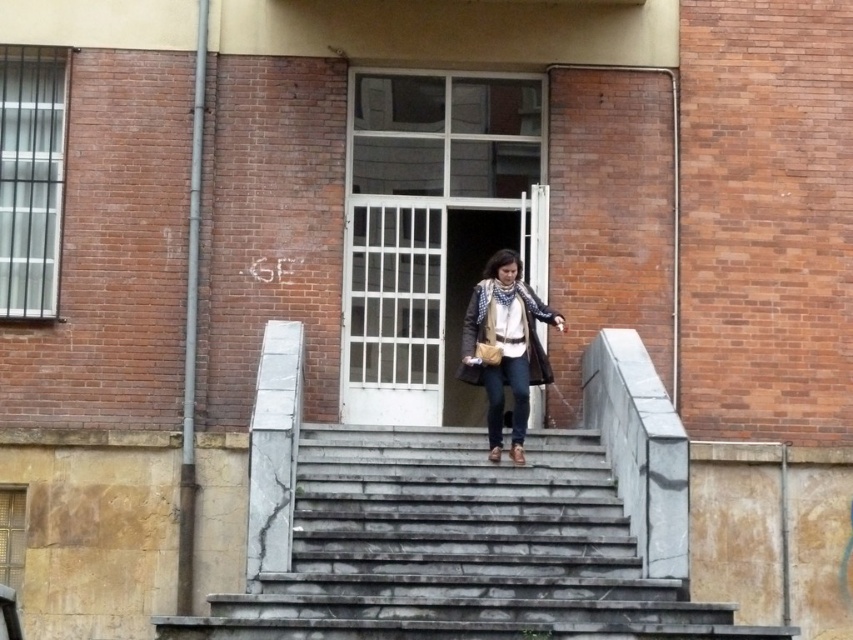
Question: Does gray marble stairs at center appear on the right side of brown leather jacket at center?

Choices:
 (A) yes
 (B) no

Answer: (B)

Question: Considering the relative positions of gray marble stairs at center and brown leather jacket at center in the image provided, where is gray marble stairs at center located with respect to brown leather jacket at center?

Choices:
 (A) below
 (B) above

Answer: (A)

Question: From the image, what is the correct spatial relationship of gray marble stairs at center in relation to brown leather jacket at center?

Choices:
 (A) left
 (B) right

Answer: (A)

Question: Which point is closer to the camera?

Choices:
 (A) gray marble stairs at center
 (B) brown leather jacket at center

Answer: (A)

Question: Which object is closer to the camera taking this photo?

Choices:
 (A) gray marble stairs at center
 (B) brown leather jacket at center

Answer: (A)